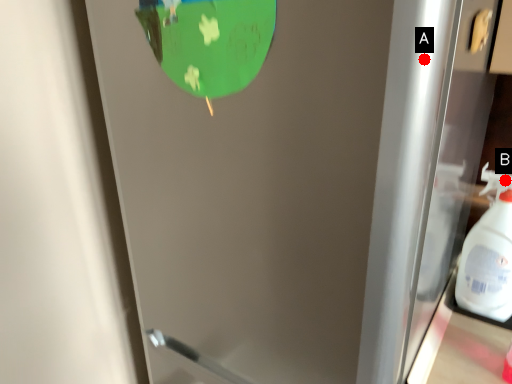
Question: Two points are circled on the image, labeled by A and B beside each circle. Which point is farther from the camera taking this photo?

Choices:
 (A) A is further
 (B) B is further

Answer: (B)